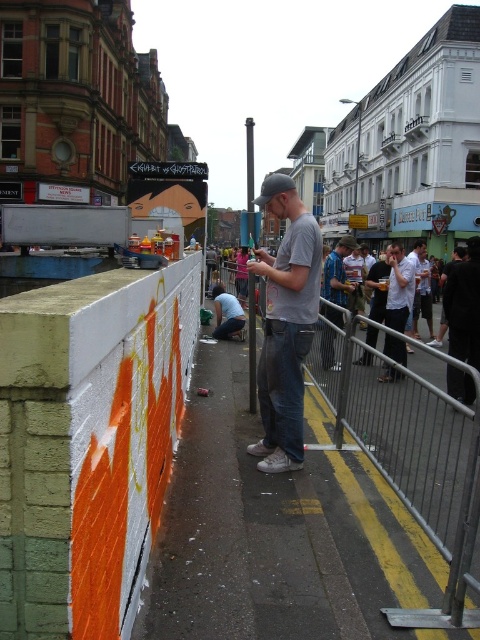
Between point (106, 598) and point (348, 250), which one is positioned behind?

Positioned behind is point (348, 250).

Which of these two, white painted concrete wall at left or blue denim jeans at center, stands taller?

Standing taller between the two is blue denim jeans at center.

Does point (23, 536) lie in front of point (347, 305)?

Yes, point (23, 536) is closer to viewer.

Find the location of `white painted concrete wall at left`. white painted concrete wall at left is located at coordinates (88, 442).

Which of these two, gray matte t-shirt at center or blue denim jeans at center, stands taller?

gray matte t-shirt at center

Is gray matte t-shirt at center bigger than blue denim jeans at center?

Correct, gray matte t-shirt at center is larger in size than blue denim jeans at center.

Is point (276, 317) farther from camera compared to point (336, 298)?

That is False.

At what (x,y) coordinates should I click in order to perform the action: click on gray matte t-shirt at center. Please return your answer as a coordinate pair (x, y). This screenshot has width=480, height=640. Looking at the image, I should click on (286, 324).

Between gray matte t-shirt at center and white shirt at center, which one is positioned lower?

gray matte t-shirt at center

Does point (297, 452) lie behind point (408, 307)?

No, it is not.

Image resolution: width=480 pixels, height=640 pixels. I want to click on gray matte t-shirt at center, so click(x=286, y=324).